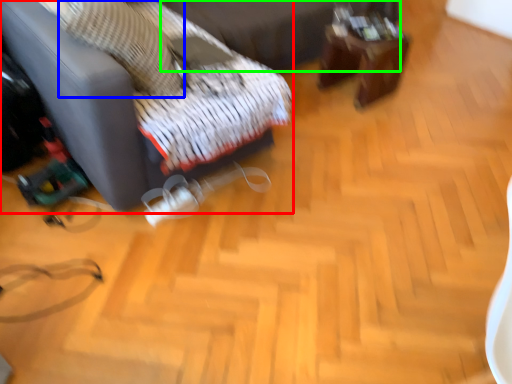
Question: Which object is positioned closest to furniture (highlighted by a red box)? Select from pillow (highlighted by a blue box) and bed frame (highlighted by a green box).

Choices:
 (A) pillow
 (B) bed frame

Answer: (A)